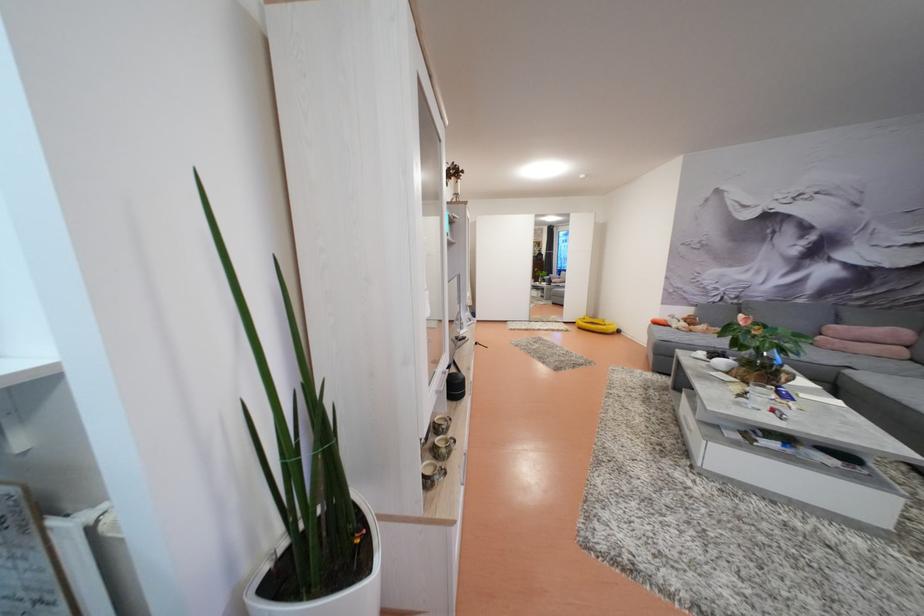
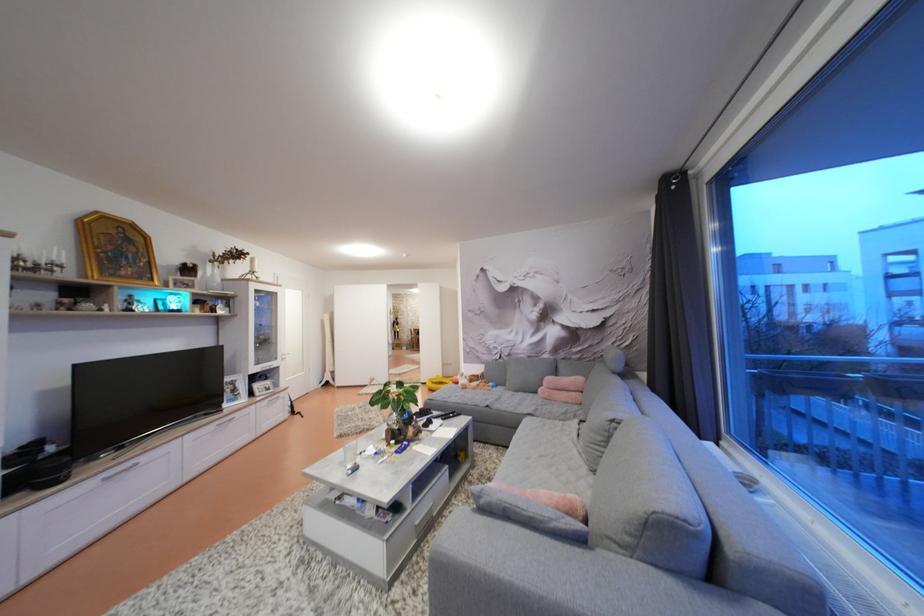
Question: In a continuous first-person perspective shot, in which direction is the camera moving?

Choices:
 (A) Left
 (B) Right
 (C) Forward
 (D) Backward

Answer: (B)